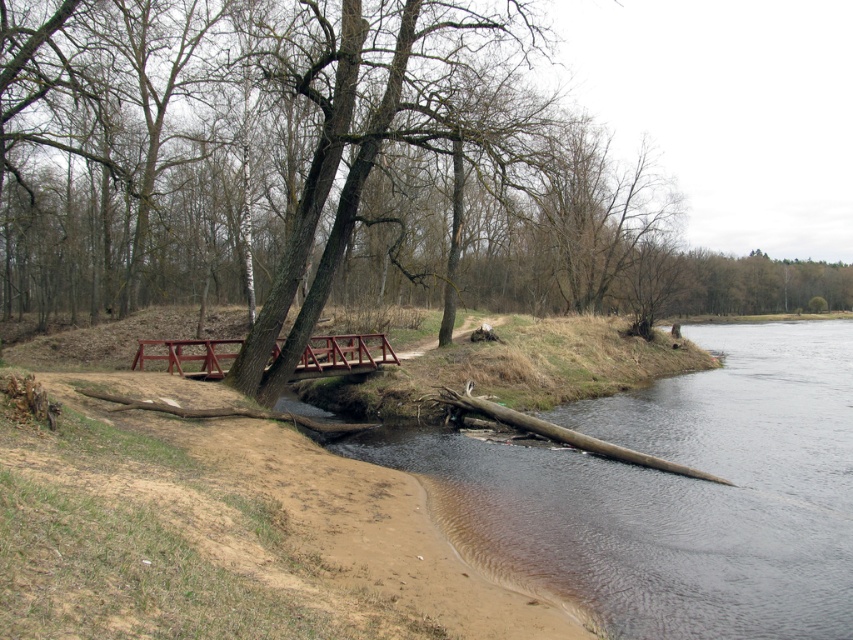
Question: Is metallic red bridge at center to the left of brown wood log at lower right from the viewer's perspective?

Choices:
 (A) no
 (B) yes

Answer: (B)

Question: Where is metallic red bridge at center located in relation to brown wood log at lower right in the image?

Choices:
 (A) right
 (B) left

Answer: (B)

Question: Which point is farther to the camera?

Choices:
 (A) (164, 358)
 (B) (529, 419)

Answer: (A)

Question: Is metallic red bridge at center below brown wood log at lower right?

Choices:
 (A) no
 (B) yes

Answer: (A)